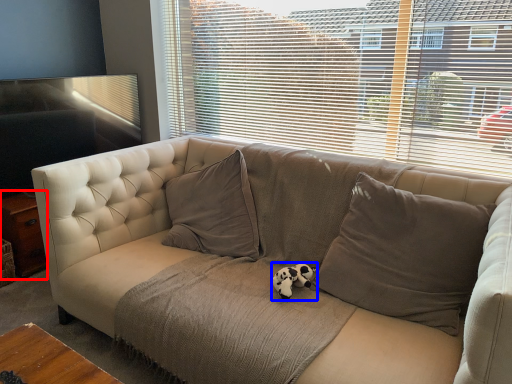
Question: Which object appears closest to the camera in this image, table (highlighted by a red box) or animal (highlighted by a blue box)?

Choices:
 (A) table
 (B) animal

Answer: (B)